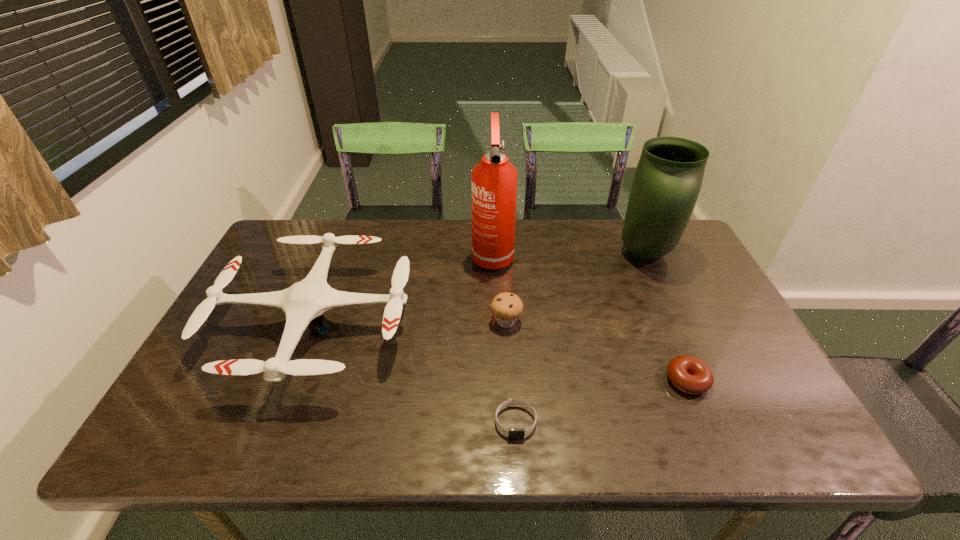
Find the location of a particular element. fire extinguisher is located at coordinates (494, 180).

Where is `the fifth shortest object`? Image resolution: width=960 pixels, height=540 pixels. the fifth shortest object is located at coordinates (669, 175).

The width and height of the screenshot is (960, 540). I want to click on the leftmost object, so click(x=303, y=303).

The width and height of the screenshot is (960, 540). Identify the location of drone. (303, 303).

The height and width of the screenshot is (540, 960). What are the coordinates of `muffin` in the screenshot? It's located at (506, 307).

Identify the location of doughnut. (689, 374).

Where is `the shortest object`? the shortest object is located at coordinates (513, 433).

This screenshot has height=540, width=960. What are the coordinates of `free space located at the nozzle of the tallest object` in the screenshot? It's located at coord(493,294).

Locate an element on the screen. This screenshot has width=960, height=540. vacant space located on the left of the vase is located at coordinates (498, 253).

Locate an element on the screen. free region located 0.390m with the camera attached at the bottom of the leftmost object is located at coordinates (559, 325).